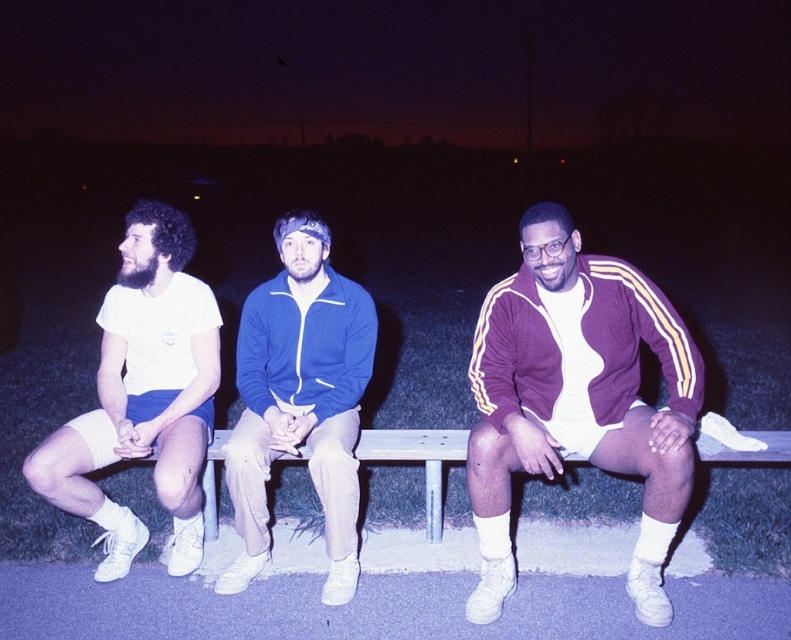
Who is positioned more to the right, purple velour tracksuit at center or wooden bench at center?

From the viewer's perspective, purple velour tracksuit at center appears more on the right side.

Does purple velour tracksuit at center have a lesser height compared to wooden bench at center?

No, purple velour tracksuit at center is not shorter than wooden bench at center.

Between point (581, 326) and point (218, 529), which one is positioned in front?

Point (581, 326) is more forward.

Where is `purple velour tracksuit at center`? This screenshot has height=640, width=791. purple velour tracksuit at center is located at coordinates (577, 400).

Which of these two, blue fleece jacket at center or wooden bench at center, stands taller?

Standing taller between the two is blue fleece jacket at center.

Locate an element on the screen. blue fleece jacket at center is located at coordinates (301, 397).

You are a GUI agent. You are given a task and a screenshot of the screen. Output one action in this format:
    pyautogui.click(x=<x>, y=<y>)
    Task: Click on the blue fleece jacket at center
    
    Given the screenshot: What is the action you would take?
    pyautogui.click(x=301, y=397)

The image size is (791, 640). What do you see at coordinates (577, 400) in the screenshot?
I see `purple velour tracksuit at center` at bounding box center [577, 400].

Does point (496, 595) lie in front of point (176, 573)?

Yes, point (496, 595) is in front of point (176, 573).

You are a GUI agent. You are given a task and a screenshot of the screen. Output one action in this format:
    pyautogui.click(x=<x>, y=<y>)
    Task: Click on the purple velour tracksuit at center
    Image resolution: width=791 pixels, height=640 pixels.
    Given the screenshot: What is the action you would take?
    pyautogui.click(x=577, y=400)